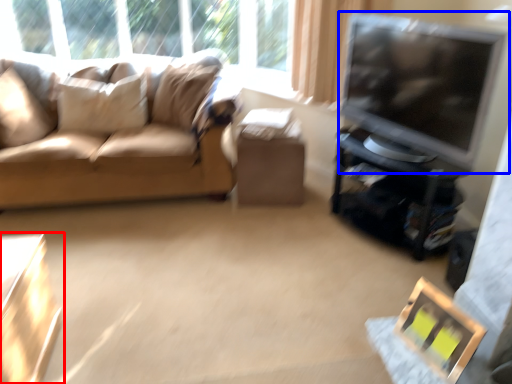
Question: Among these objects, which one is nearest to the camera, table (highlighted by a red box) or television (highlighted by a blue box)?

Choices:
 (A) table
 (B) television

Answer: (A)